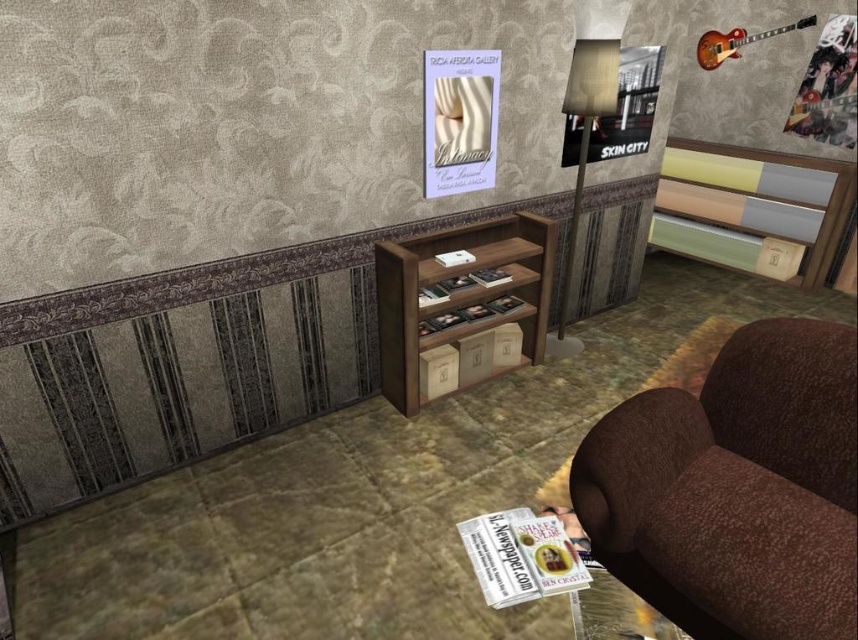
Question: Which of the following is the closest to the observer?

Choices:
 (A) (754, 620)
 (B) (390, 388)

Answer: (A)

Question: Which object is closer to the camera taking this photo?

Choices:
 (A) brown textured armchair at lower right
 (B) brown wood entertainment center at center

Answer: (A)

Question: Is brown textured armchair at lower right above brown wood entertainment center at center?

Choices:
 (A) no
 (B) yes

Answer: (A)

Question: Is brown textured armchair at lower right bigger than brown wood entertainment center at center?

Choices:
 (A) no
 (B) yes

Answer: (A)

Question: Does brown textured armchair at lower right have a lesser width compared to brown wood entertainment center at center?

Choices:
 (A) yes
 (B) no

Answer: (A)